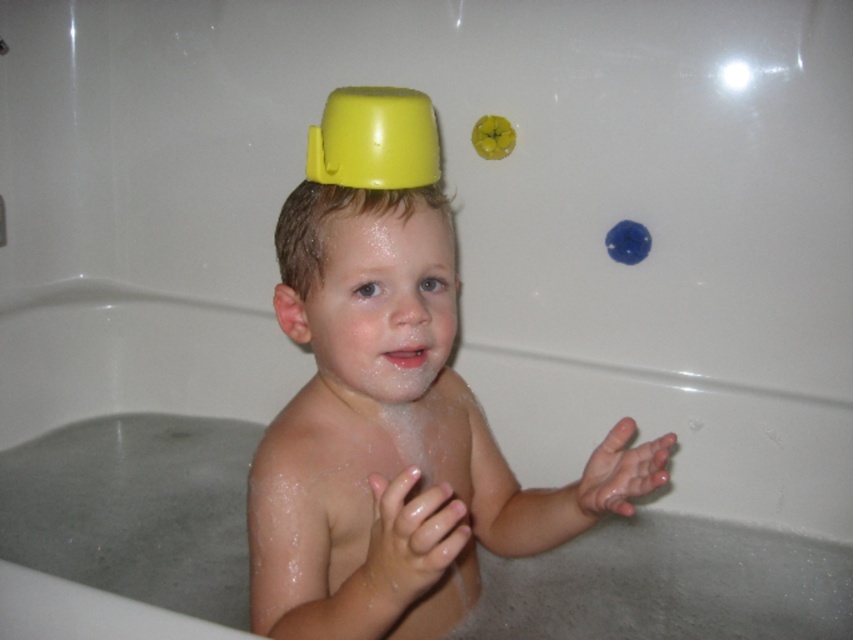
You are a photographer taking a picture of the child in the bathtub. You notice two points in the image, point A at coordinates point (352, 388) and point B at coordinates point (749, 83). Which point is closer to you?

Point A at coordinates point (352, 388) is closer to the viewer than point B at coordinates point (749, 83).

You are a parent trying to retrieve the yellow plastic cup at upper center from the bathtub. The child is currently holding the shiny skin at center. Can you reach the cup without touching the child?

The yellow plastic cup at upper center is in front of the shiny skin at center, so you can reach it without touching the child by moving around the child or from the front where it is accessible.